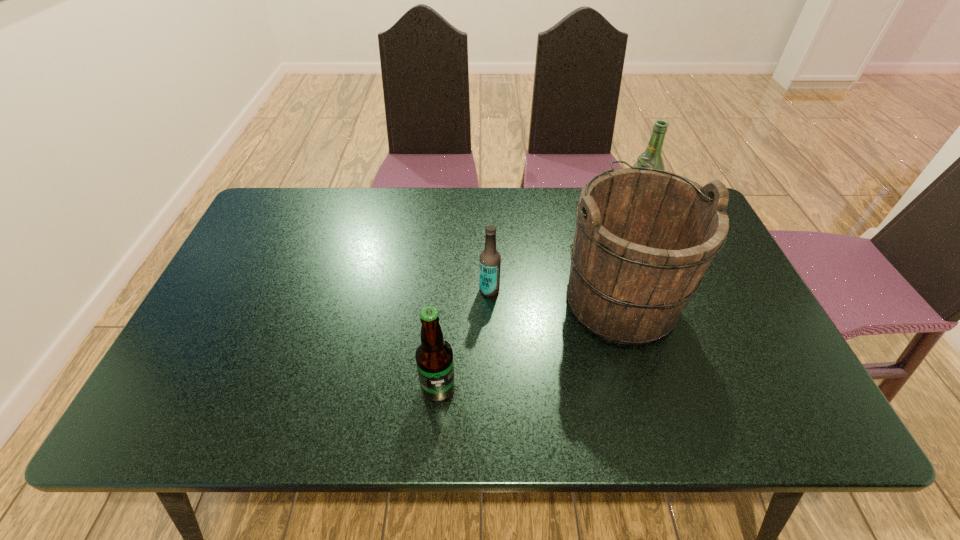
Find the location of `free location that satisfies the following two spatial constraints: 1. on the side of the bucket with the label; 2. on the right side of the shortest object`. free location that satisfies the following two spatial constraints: 1. on the side of the bucket with the label; 2. on the right side of the shortest object is located at coordinates (490, 298).

Where is `vacant area in the image that satisfies the following two spatial constraints: 1. on the surface of the rightmost beer bottle; 2. on the label of the nearest beer bottle`? vacant area in the image that satisfies the following two spatial constraints: 1. on the surface of the rightmost beer bottle; 2. on the label of the nearest beer bottle is located at coordinates (709, 388).

Locate an element on the screen. This screenshot has height=540, width=960. free spot that satisfies the following two spatial constraints: 1. on the side of the shortest beer bottle with the label; 2. on the label of the nearest beer bottle is located at coordinates (492, 388).